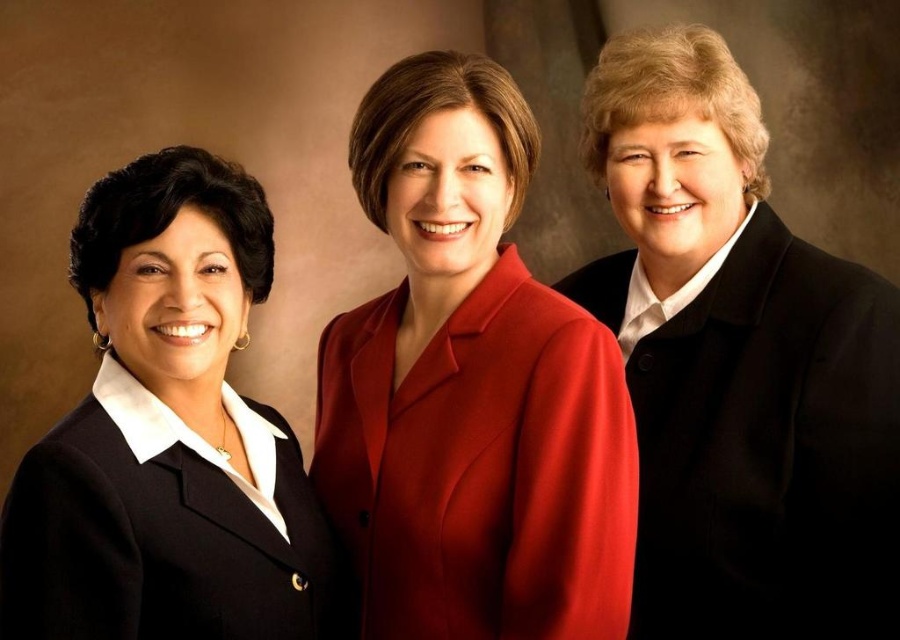
Can you confirm if matte red blazer at center is positioned below matte black blazer at left?

No, matte red blazer at center is not below matte black blazer at left.

Which of these two, matte red blazer at center or matte black blazer at left, stands taller?

With more height is matte red blazer at center.

What do you see at coordinates (470, 387) in the screenshot?
I see `matte red blazer at center` at bounding box center [470, 387].

The width and height of the screenshot is (900, 640). What are the coordinates of `matte red blazer at center` in the screenshot? It's located at (470, 387).

Does matte black blazer at left have a larger size compared to black woolen jacket at right?

No.

Who is higher up, matte black blazer at left or black woolen jacket at right?

Positioned higher is matte black blazer at left.

Where is `matte black blazer at left`? This screenshot has width=900, height=640. matte black blazer at left is located at coordinates (168, 436).

Who is positioned more to the right, matte red blazer at center or black woolen jacket at right?

black woolen jacket at right is more to the right.

Which is in front, point (352, 426) or point (796, 506)?

Point (796, 506) is more forward.

Who is more distant from viewer, (453, 164) or (750, 589)?

Positioned behind is point (750, 589).

At what (x,y) coordinates should I click in order to perform the action: click on matte red blazer at center. Please return your answer as a coordinate pair (x, y). Looking at the image, I should click on (x=470, y=387).